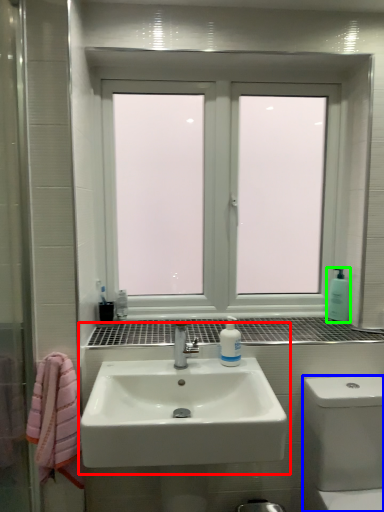
Question: Estimate the real-world distances between objects in this image. Which object is farther from sink (highlighted by a red box), bath (highlighted by a blue box) or soap dispenser (highlighted by a green box)?

Choices:
 (A) bath
 (B) soap dispenser

Answer: (B)